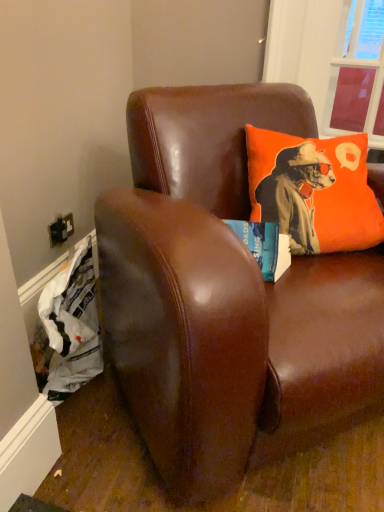
Question: Is transparent plastic window screen at upper right bigger than brown leather couch at upper center?

Choices:
 (A) yes
 (B) no

Answer: (B)

Question: Is transparent plastic window screen at upper right positioned beyond the bounds of brown leather couch at upper center?

Choices:
 (A) no
 (B) yes

Answer: (B)

Question: Is transparent plastic window screen at upper right facing away from brown leather couch at upper center?

Choices:
 (A) yes
 (B) no

Answer: (B)

Question: Can you confirm if transparent plastic window screen at upper right is positioned to the left of brown leather couch at upper center?

Choices:
 (A) no
 (B) yes

Answer: (A)

Question: From a real-world perspective, is transparent plastic window screen at upper right positioned over brown leather couch at upper center based on gravity?

Choices:
 (A) no
 (B) yes

Answer: (B)

Question: Based on their sizes in the image, would you say transparent plastic window screen at upper right is bigger or smaller than orange fabric pillow at upper right?

Choices:
 (A) big
 (B) small

Answer: (B)

Question: Would you say transparent plastic window screen at upper right is inside or outside orange fabric pillow at upper right?

Choices:
 (A) inside
 (B) outside

Answer: (B)

Question: Is transparent plastic window screen at upper right to the left or to the right of orange fabric pillow at upper right in the image?

Choices:
 (A) right
 (B) left

Answer: (A)

Question: From a real-world perspective, is transparent plastic window screen at upper right above or below orange fabric pillow at upper right?

Choices:
 (A) above
 (B) below

Answer: (A)

Question: Is orange fabric pillow at upper right bigger or smaller than brown leather couch at upper center?

Choices:
 (A) small
 (B) big

Answer: (A)

Question: In terms of height, does orange fabric pillow at upper right look taller or shorter compared to brown leather couch at upper center?

Choices:
 (A) tall
 (B) short

Answer: (B)

Question: Is orange fabric pillow at upper right spatially inside brown leather couch at upper center, or outside of it?

Choices:
 (A) outside
 (B) inside

Answer: (B)

Question: From the image's perspective, relative to brown leather couch at upper center, is orange fabric pillow at upper right above or below?

Choices:
 (A) below
 (B) above

Answer: (B)

Question: From the image's perspective, relative to transparent plastic window screen at upper right, is brown leather couch at upper center above or below?

Choices:
 (A) above
 (B) below

Answer: (B)

Question: From their relative heights in the image, would you say brown leather couch at upper center is taller or shorter than transparent plastic window screen at upper right?

Choices:
 (A) tall
 (B) short

Answer: (A)